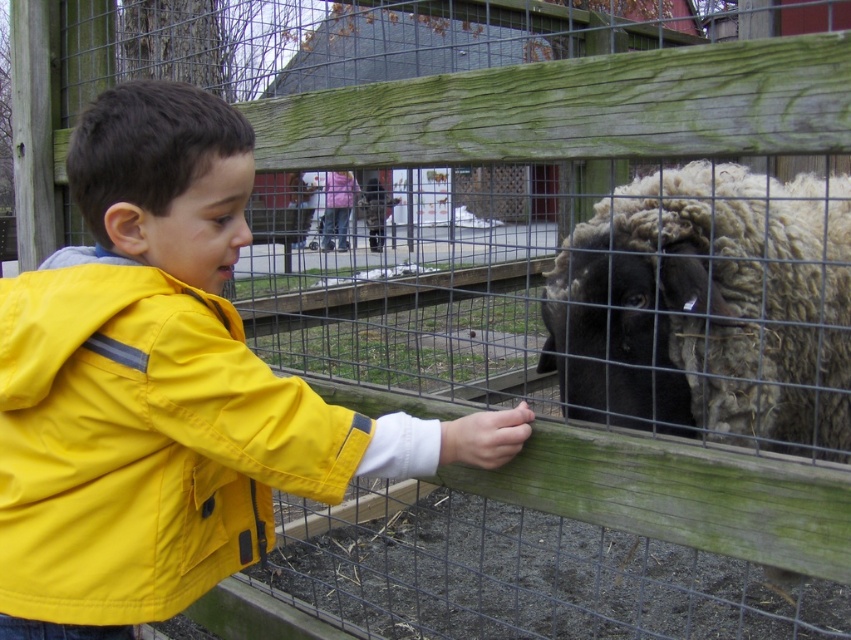
Question: Does yellow matte jacket at left come in front of black woolly sheep at center?

Choices:
 (A) yes
 (B) no

Answer: (A)

Question: Based on their relative distances, which object is nearer to the yellow matte jacket at left?

Choices:
 (A) black woolly sheep at center
 (B) yellow matte jacket at center

Answer: (B)

Question: From the image, what is the correct spatial relationship of yellow matte jacket at center in relation to yellow matte jacket at left?

Choices:
 (A) above
 (B) below

Answer: (A)

Question: Is yellow matte jacket at center thinner than yellow matte jacket at left?

Choices:
 (A) yes
 (B) no

Answer: (B)

Question: Which of the following is the farthest from the observer?

Choices:
 (A) yellow matte jacket at center
 (B) black woolly sheep at center
 (C) yellow matte jacket at left

Answer: (B)

Question: Which point is closer to the camera?

Choices:
 (A) yellow matte jacket at left
 (B) yellow matte jacket at center
 (C) black woolly sheep at center

Answer: (A)